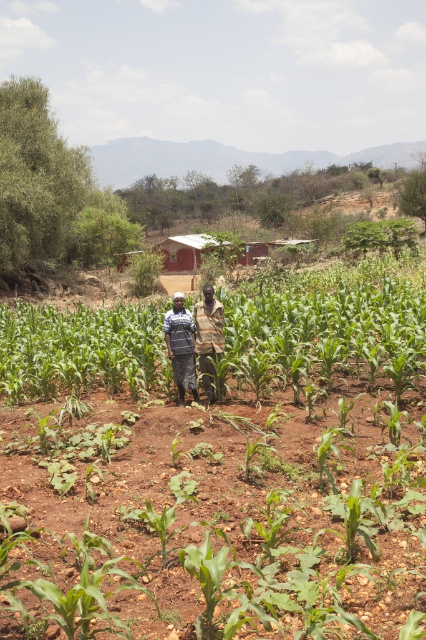
Is green leafy corn at center thinner than camouflage fabric shirt at center?

No, green leafy corn at center is not thinner than camouflage fabric shirt at center.

Between point (221, 548) and point (213, 356), which one is positioned behind?

The point (213, 356) is behind.

Locate an element on the screen. The image size is (426, 640). green leafy corn at center is located at coordinates (219, 465).

Which is more to the right, green leafy corn at center or dark blue shirt at center?

Positioned to the right is dark blue shirt at center.

Is green leafy corn at center positioned before dark blue shirt at center?

That is True.

At what (x,y) coordinates should I click in order to perform the action: click on green leafy corn at center. Please return your answer as a coordinate pair (x, y). The width and height of the screenshot is (426, 640). Looking at the image, I should click on (219, 465).

Does dark blue shirt at center come in front of camouflage fabric shirt at center?

No, it is behind camouflage fabric shirt at center.

Does dark blue shirt at center have a greater width compared to camouflage fabric shirt at center?

No, dark blue shirt at center is not wider than camouflage fabric shirt at center.

Between point (166, 332) and point (207, 401), which one is positioned behind?

The point (166, 332) is behind.

Identify the location of dark blue shirt at center. The width and height of the screenshot is (426, 640). (181, 346).